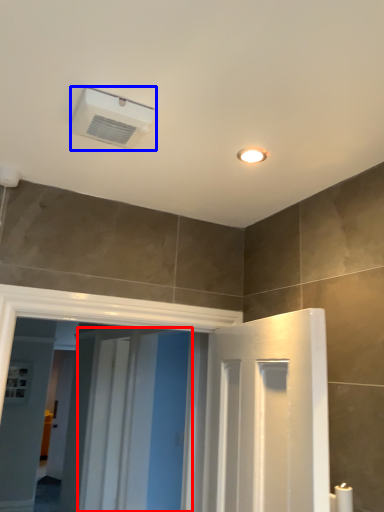
Question: Among these objects, which one is farthest to the camera, screen door (highlighted by a red box) or air conditioning (highlighted by a blue box)?

Choices:
 (A) screen door
 (B) air conditioning

Answer: (A)